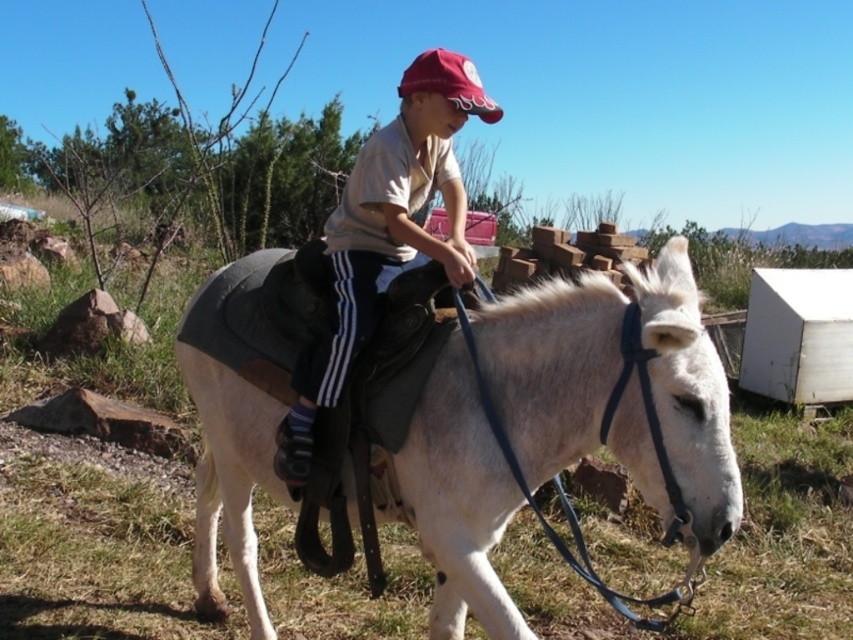
Is point (254, 538) less distant than point (483, 102)?

That is False.

Which is in front, point (349, 484) or point (341, 212)?

Point (349, 484)

Who is more distant from viewer, (602, 362) or (358, 170)?

Positioned behind is point (358, 170).

This screenshot has height=640, width=853. Identify the location of white matte donkey at center. (456, 499).

Does matte khaki shirt at center appear under maroon fabric baseball cap at upper center?

Correct, matte khaki shirt at center is located below maroon fabric baseball cap at upper center.

Can you confirm if matte khaki shirt at center is positioned to the left of maroon fabric baseball cap at upper center?

Indeed, matte khaki shirt at center is positioned on the left side of maroon fabric baseball cap at upper center.

Does point (421, 96) come in front of point (460, 68)?

No.

The height and width of the screenshot is (640, 853). In order to click on matte khaki shirt at center in this screenshot , I will do `click(386, 232)`.

Measure the distance from white matte donkey at center to maroon fabric baseball cap at upper center.

white matte donkey at center and maroon fabric baseball cap at upper center are 3.74 feet apart from each other.

Is white matte donkey at center taller than maroon fabric baseball cap at upper center?

Correct, white matte donkey at center is much taller as maroon fabric baseball cap at upper center.

Between point (379, 499) and point (489, 97), which one is positioned in front?

Point (379, 499) is more forward.

Locate an element on the screen. The width and height of the screenshot is (853, 640). white matte donkey at center is located at coordinates (456, 499).